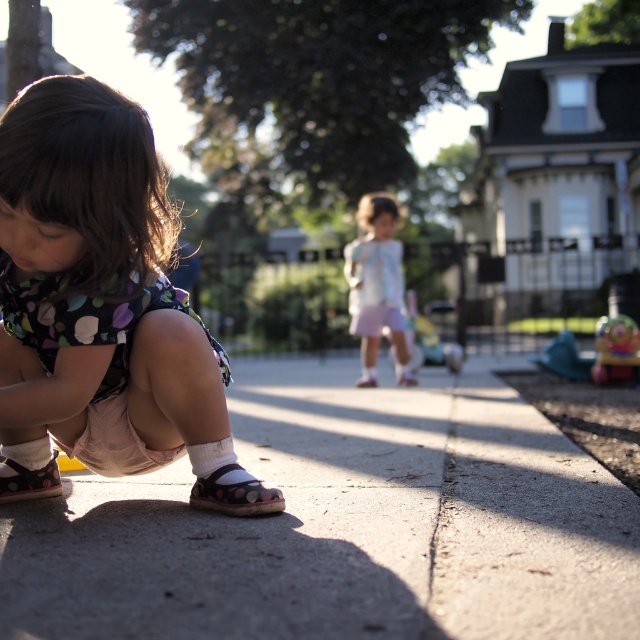
You are a photographer trying to capture a closeup of the light blue fabric dress at center and the polka dot fabric sandal at lower left. Which object should you zoom in on to ensure both are in focus without moving the camera?

The light blue fabric dress at center is wider than the polka dot fabric sandal at lower left, so you should zoom in on the light blue fabric dress at center to ensure both are in focus without moving the camera.